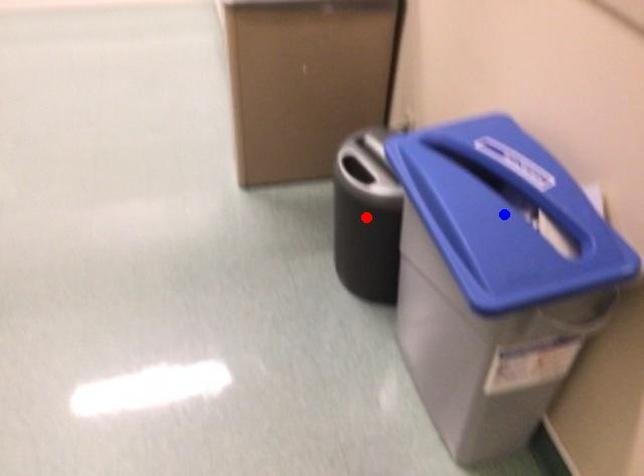
Question: Which of the two points in the image is closer to the camera?

Choices:
 (A) Blue point is closer.
 (B) Red point is closer.

Answer: (A)